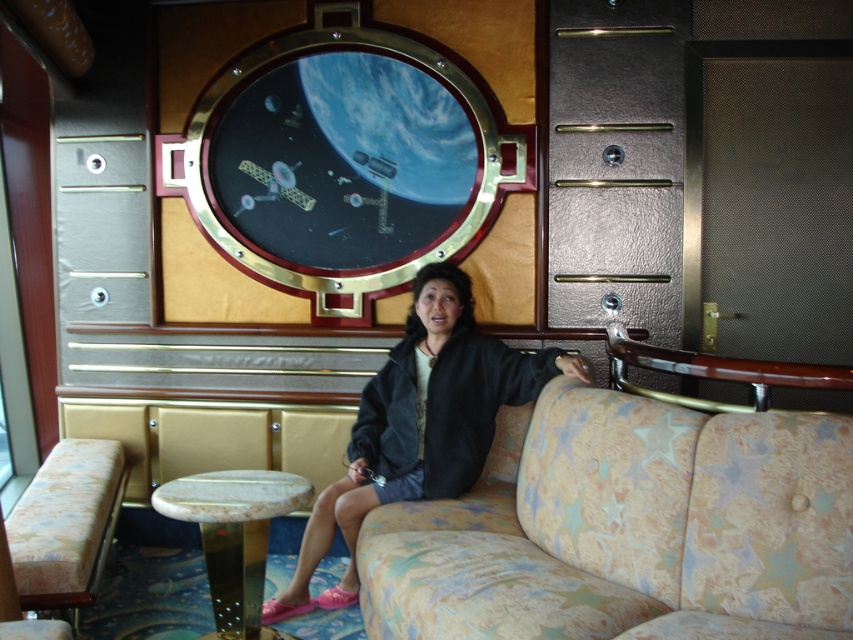
Looking at this image, you are standing in the themed room and want to take a photo of both the porthole window and the sofa. You notice two points marked in the scene at coordinates point (624, 444) and point (71, 586). Which point should you focus on to ensure both the porthole window and the sofa are in sharp focus?

You should focus on point (624, 444) because it is closer to the camera than point (71, 586), ensuring both the porthole window and the sofa are in focus.

You are standing in the space themed room and want to take a photo of the two points. Which point, point (376, 518) or point (489, 433), will appear larger in your camera view?

Point (376, 518) will appear larger in the camera view because it is closer to the camera than point (489, 433).